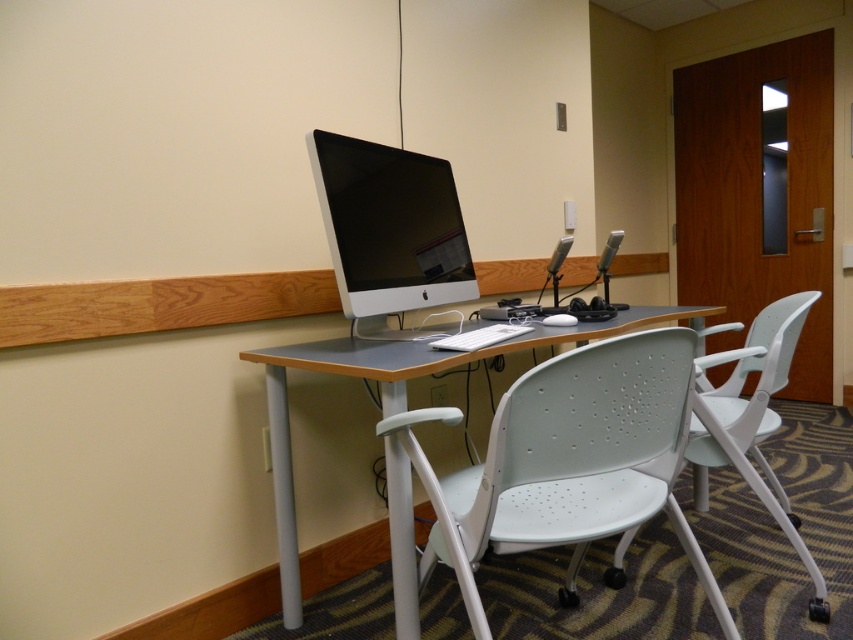
Question: Is satin black monitor at center wider than matte gray desk at center?

Choices:
 (A) yes
 (B) no

Answer: (B)

Question: Among these points, which one is nearest to the camera?

Choices:
 (A) (381, 204)
 (B) (735, 456)

Answer: (B)

Question: Does satin black monitor at center appear on the left side of white plastic chair at center?

Choices:
 (A) no
 (B) yes

Answer: (B)

Question: Is satin black monitor at center positioned at the back of matte gray desk at center?

Choices:
 (A) no
 (B) yes

Answer: (B)

Question: Which point is farther to the camera?

Choices:
 (A) (718, 422)
 (B) (277, 540)

Answer: (B)

Question: Which point is closer to the camera?

Choices:
 (A) white plastic chair at center
 (B) satin black monitor at center
 (C) matte gray desk at center

Answer: (C)